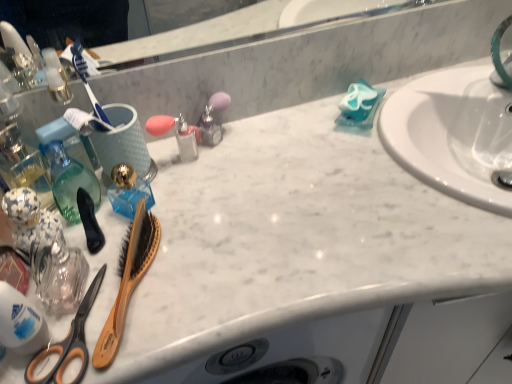
The height and width of the screenshot is (384, 512). I want to click on free space in front of translucent blue glass at center, so click(x=147, y=294).